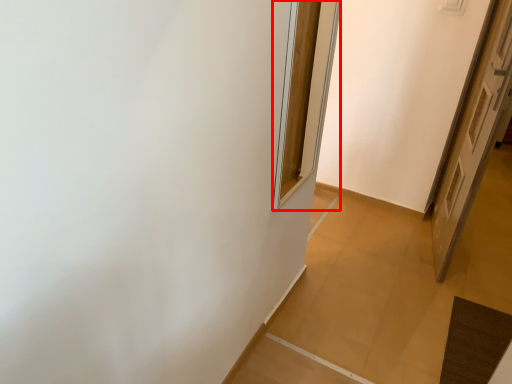
Question: From the image's perspective, what is the correct spatial positioning of window (annotated by the red box) in reference to door?

Choices:
 (A) below
 (B) above

Answer: (B)